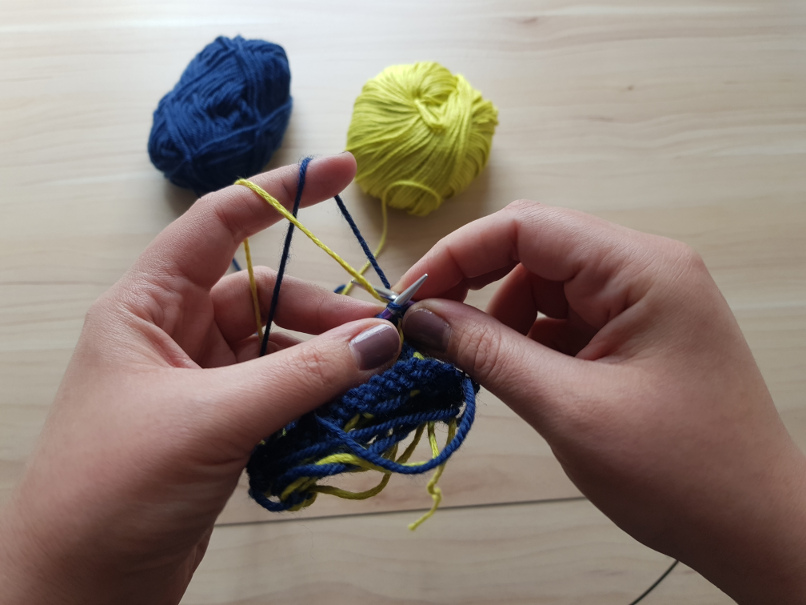
The height and width of the screenshot is (605, 806). In order to click on table in this screenshot , I will do `click(75, 206)`, `click(629, 140)`, `click(497, 561)`.